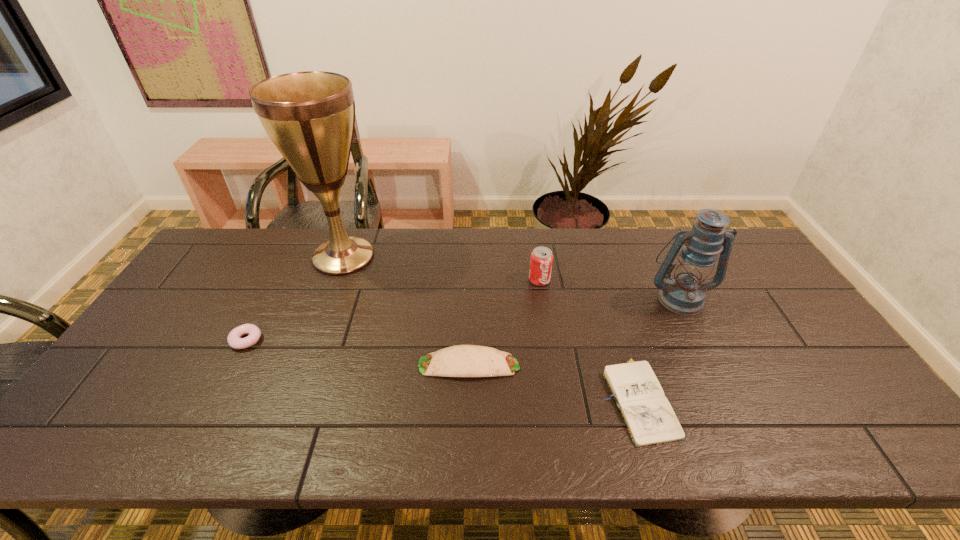
Locate an element on the screen. trophy cup is located at coordinates (310, 116).

You are a GUI agent. You are given a task and a screenshot of the screen. Output one action in this format:
    pyautogui.click(x=<x>, y=<y>)
    Task: Click on the tallest object
    
    Given the screenshot: What is the action you would take?
    pyautogui.click(x=310, y=116)

Image resolution: width=960 pixels, height=540 pixels. I want to click on the fifth shortest object, so click(684, 294).

Image resolution: width=960 pixels, height=540 pixels. I want to click on lantern, so (x=684, y=294).

Where is `the fourth shortest object`? the fourth shortest object is located at coordinates click(541, 260).

The image size is (960, 540). I want to click on soda can, so click(541, 260).

Where is `burrito`? burrito is located at coordinates (461, 360).

Locate an element on the screen. doughnut is located at coordinates (234, 340).

Identify the location of notebook. The height and width of the screenshot is (540, 960). (647, 413).

I want to click on the shortest object, so (647, 413).